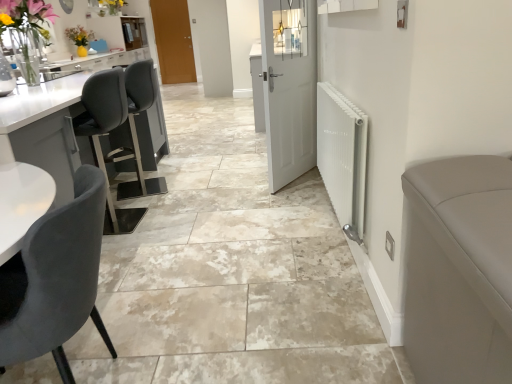
In order to click on free spot to the left of white matte door at center, positioned as the second door in left-to-right order in this screenshot , I will do `click(237, 181)`.